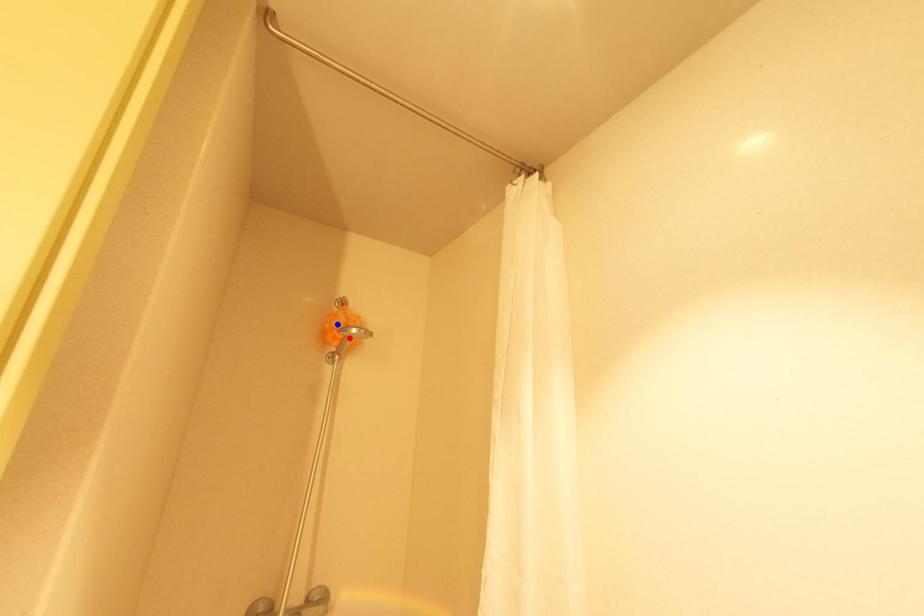
Question: Which of the two points in the image is closer to the camera?

Choices:
 (A) Blue point is closer.
 (B) Red point is closer.

Answer: (A)